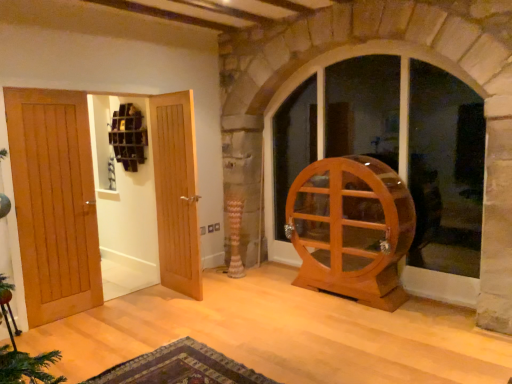
Identify the location of vacant area on top of light brown wood door at left, which appears as the 2th door when viewed from the right (from a real-world perspective). This screenshot has height=384, width=512. (89, 86).